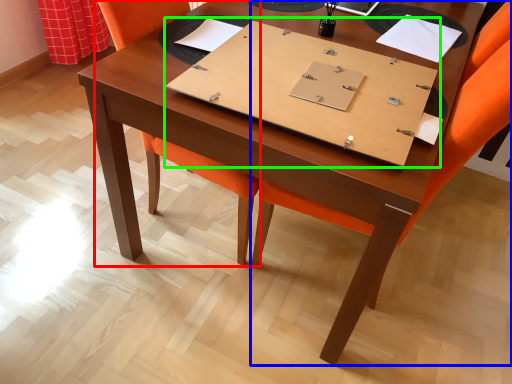
Question: Which object is the closest to the swivel chair (highlighted by a red box)? Choose among these: chair (highlighted by a blue box) or notebook (highlighted by a green box).

Choices:
 (A) chair
 (B) notebook

Answer: (A)